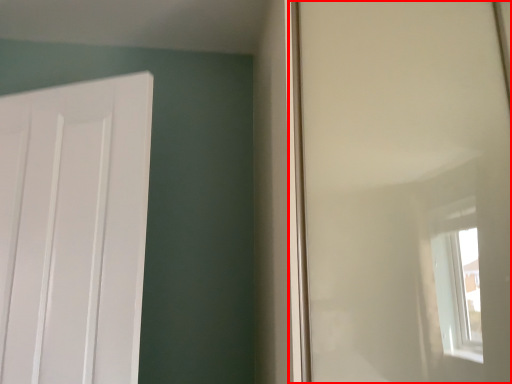
Question: From the image's perspective, where is window screen (annotated by the red box) located in relation to door in the image?

Choices:
 (A) above
 (B) below

Answer: (A)